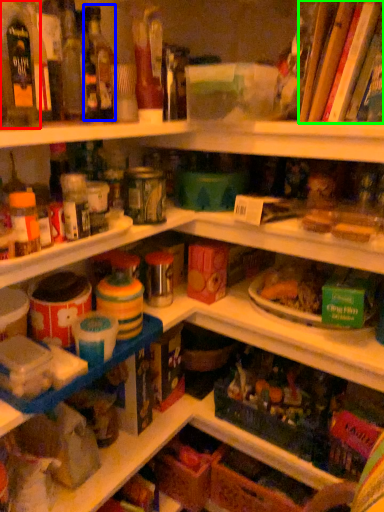
Question: Which object is positioned closest to bottle (highlighted by a red box)? Select from bottle (highlighted by a blue box) and book (highlighted by a green box).

Choices:
 (A) bottle
 (B) book

Answer: (A)